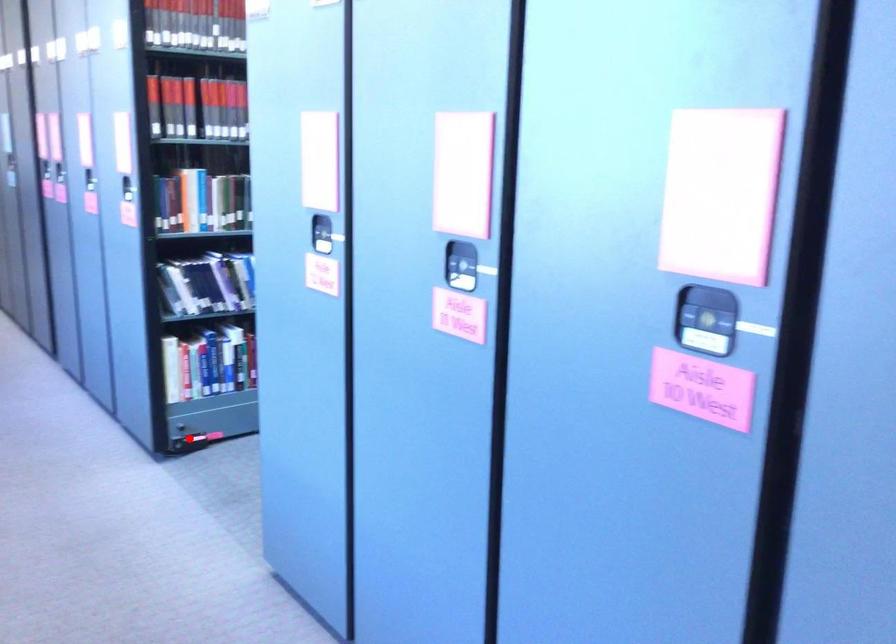
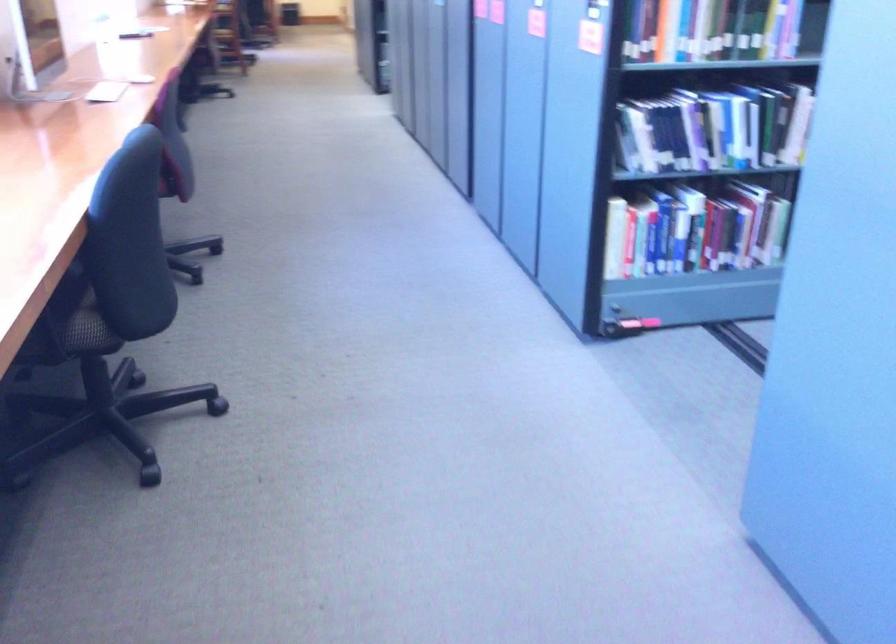
Question: I am providing you with two images of the same scene from different viewpoints. A red point is shown in image1. For the corresponding object point in image2, is it positioned nearer or farther from the camera?

Choices:
 (A) Nearer
 (B) Farther

Answer: (A)